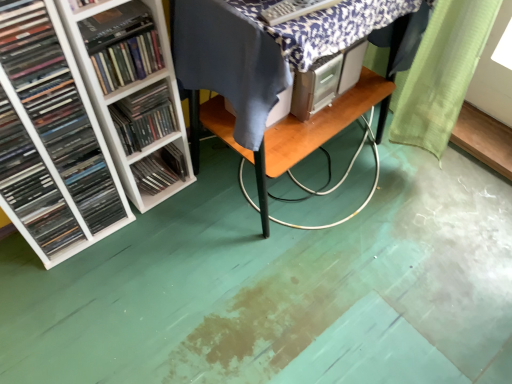
Find the location of a particular element. The image size is (512, 384). vacant area located to the right-hand side of white plastic shelf at left, positioned as the 2th shelf in back-to-front order is located at coordinates (206, 204).